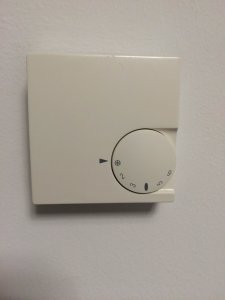
You are a GUI agent. You are given a task and a screenshot of the screen. Output one action in this format:
    pyautogui.click(x=<x>, y=<y>)
    Task: Click on the wall on the bottom
    Image resolution: width=225 pixels, height=300 pixels.
    Given the screenshot: What is the action you would take?
    pyautogui.click(x=111, y=262)